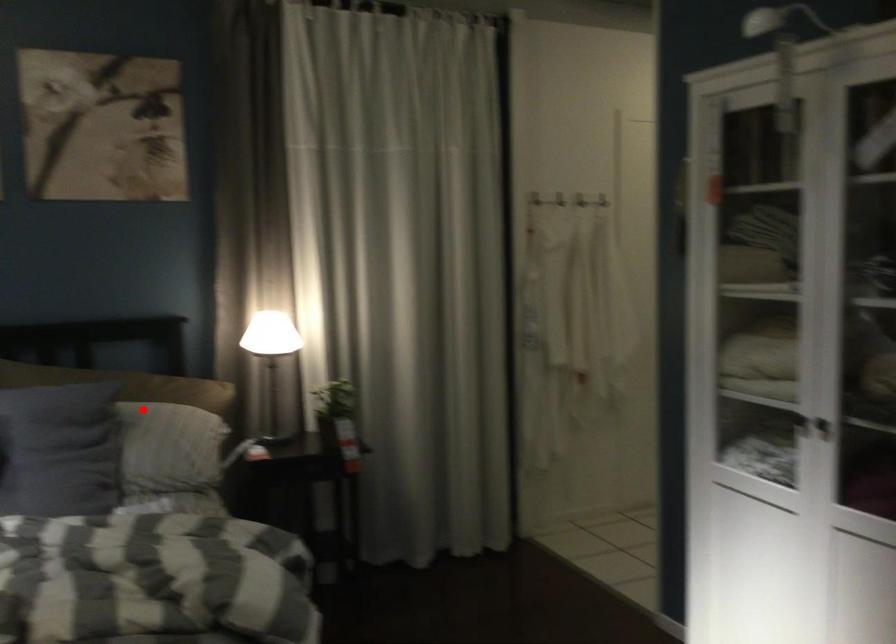
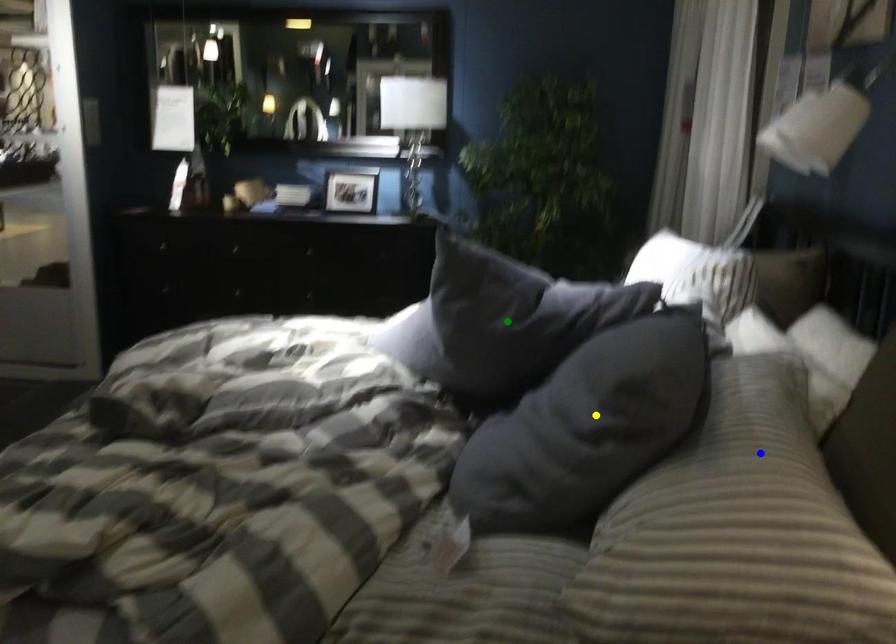
Question: I am providing you with two images of the same scene from different viewpoints. A red point is marked on the first image. You are given multiple points on the second image. Can you choose the point in image 2 that corresponds to the point in image 1?

Choices:
 (A) green point
 (B) blue point
 (C) yellow point

Answer: (B)